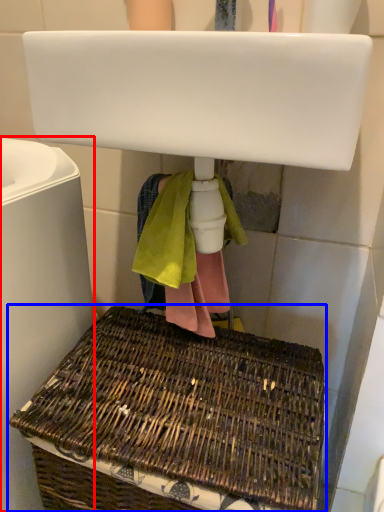
Question: Which point is closer to the camera, bath (highlighted by a red box) or picnic basket (highlighted by a blue box)?

Choices:
 (A) bath
 (B) picnic basket

Answer: (A)